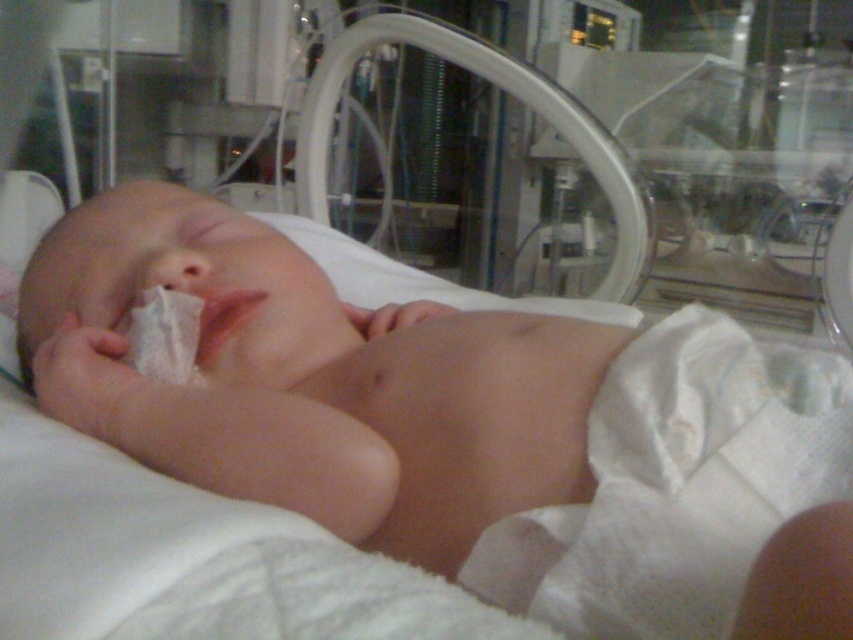
Does white cloth diaper at center appear under smooth flesh nose at center?

Correct, white cloth diaper at center is located below smooth flesh nose at center.

Does white cloth diaper at center appear over smooth flesh nose at center?

Incorrect, white cloth diaper at center is not positioned above smooth flesh nose at center.

What do you see at coordinates (677, 484) in the screenshot? This screenshot has width=853, height=640. I see `white cloth diaper at center` at bounding box center [677, 484].

Locate an element on the screen. Image resolution: width=853 pixels, height=640 pixels. white cloth diaper at center is located at coordinates (677, 484).

Who is positioned more to the right, smooth skin newborn at center or smooth flesh nose at center?

smooth skin newborn at center is more to the right.

Who is positioned more to the left, smooth skin newborn at center or smooth flesh nose at center?

From the viewer's perspective, smooth flesh nose at center appears more on the left side.

Image resolution: width=853 pixels, height=640 pixels. What do you see at coordinates (364, 385) in the screenshot?
I see `smooth skin newborn at center` at bounding box center [364, 385].

Locate an element on the screen. smooth skin newborn at center is located at coordinates pyautogui.click(x=364, y=385).

Does smooth skin newborn at center have a greater height compared to white cloth diaper at center?

Yes.

What do you see at coordinates (364, 385) in the screenshot? The width and height of the screenshot is (853, 640). I see `smooth skin newborn at center` at bounding box center [364, 385].

Image resolution: width=853 pixels, height=640 pixels. I want to click on smooth skin newborn at center, so click(x=364, y=385).